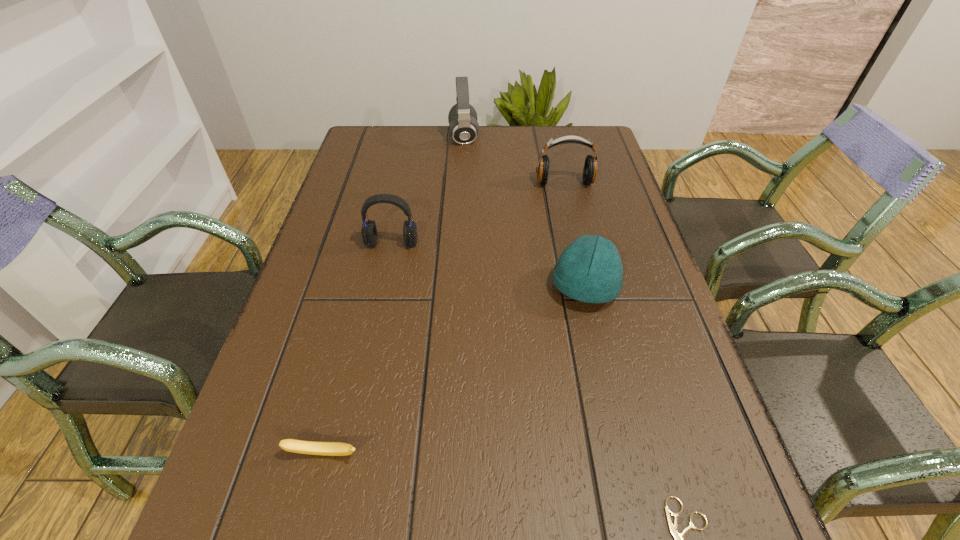
Where is `the tallest headset`? This screenshot has width=960, height=540. the tallest headset is located at coordinates (463, 127).

The image size is (960, 540). In order to click on the farthest headset in this screenshot , I will do `click(463, 127)`.

In order to click on the rightmost headset in this screenshot , I will do `click(590, 167)`.

The width and height of the screenshot is (960, 540). Find the location of `the second farthest headset`. the second farthest headset is located at coordinates (590, 167).

The width and height of the screenshot is (960, 540). I want to click on the leftmost headset, so click(369, 233).

The height and width of the screenshot is (540, 960). Identify the location of the nearest headset. (369, 233).

What are the coordinates of `the fourth tallest object` in the screenshot? It's located at click(590, 270).

The height and width of the screenshot is (540, 960). Identify the location of beanie. (590, 270).

This screenshot has height=540, width=960. I want to click on the fifth farthest object, so click(291, 445).

Where is `the second shortest object`? The image size is (960, 540). the second shortest object is located at coordinates (291, 445).